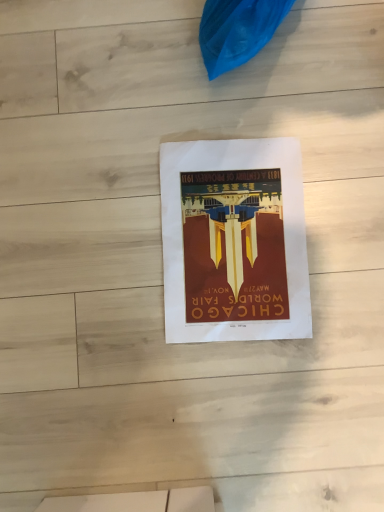
This screenshot has width=384, height=512. Identify the location of free spot above matte paper poster at center (from a real-world perspective). (237, 242).